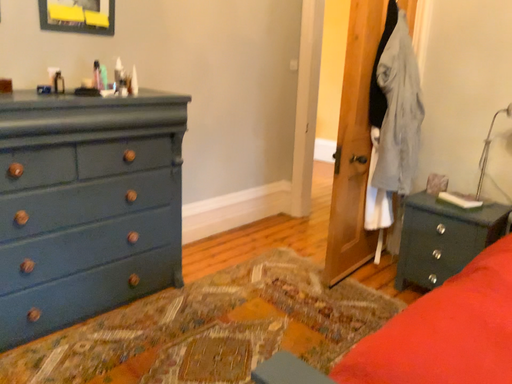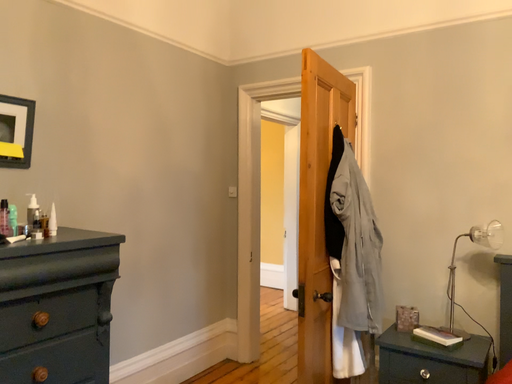
Question: Which way did the camera rotate in the video?

Choices:
 (A) rotated left
 (B) rotated right

Answer: (B)